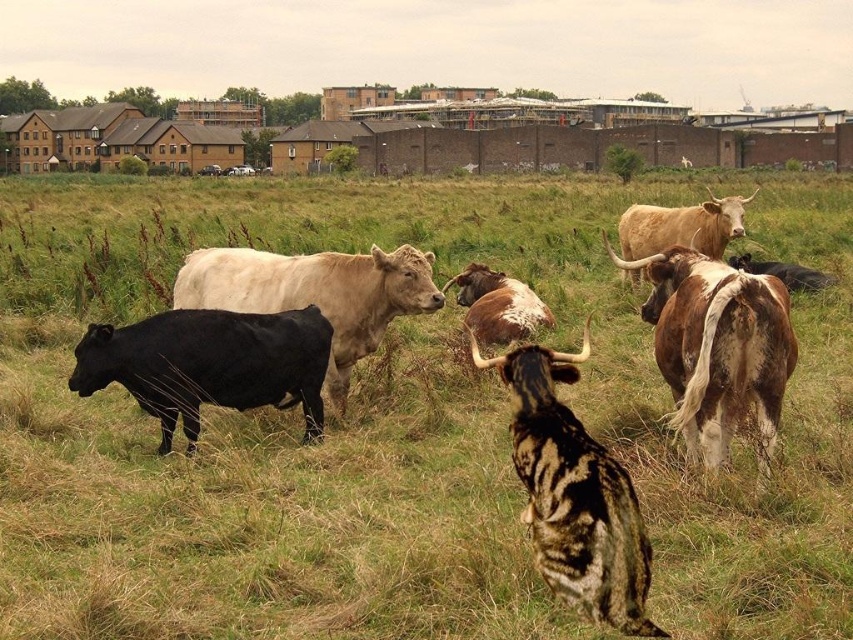
You are a farmer standing in the field and want to separate the white woolly bull at center from the light brown textured bull at upper right. Which direction should you move to first to get between them?

The white woolly bull at center is to the left of light brown textured bull at upper right. To get between them, you should move to the right side of the light brown textured bull at upper right.

You are standing in the field and see the point marked at (316,292). What animal is located at that point?

The white woolly bull at center is represented by point (316,292).

You are a farmer who needs to separate two cows with a fence. The white woolly bull at center is one of them. Which cow is the other one and how far apart are they?

The other cow is the black cow facing left, and they are 22.99 feet apart.